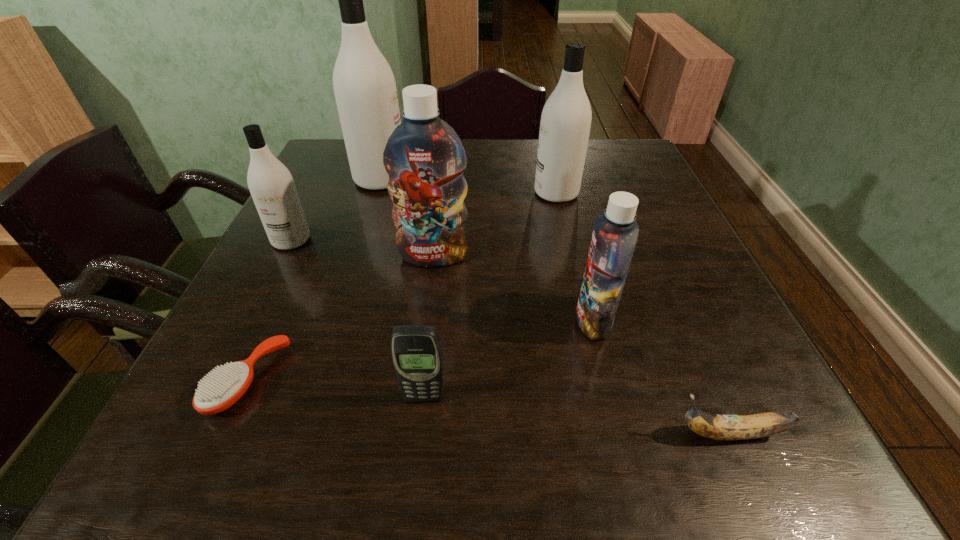
Locate an element on the screen. The width and height of the screenshot is (960, 540). vacant region located 0.190m on the front label of the fifth farthest object is located at coordinates (475, 320).

Locate an element on the screen. vacant point located 0.280m on the front label of the fifth farthest object is located at coordinates (427, 320).

Find the location of a particular element. vacant area located on the front label of the fifth farthest object is located at coordinates (544, 320).

The width and height of the screenshot is (960, 540). I want to click on vacant space located on the front-facing side of the smallest white shampoo, so click(224, 374).

Locate an element on the screen. blank space located on the screen of the cellular telephone is located at coordinates (415, 478).

I want to click on vacant space located on the peel of the rightmost object, so click(x=495, y=434).

At what (x,y) coordinates should I click in order to perform the action: click on vacant space located on the peel of the rightmost object. Please return your answer as a coordinate pair (x, y). Looking at the image, I should click on (475, 434).

Where is `free space located 0.320m on the peel of the rightmost object`? The width and height of the screenshot is (960, 540). free space located 0.320m on the peel of the rightmost object is located at coordinates (462, 434).

Where is `free space located on the right of the hairbrush`? free space located on the right of the hairbrush is located at coordinates [449, 381].

Where is `object located in the far edge section of the desktop`? object located in the far edge section of the desktop is located at coordinates (365, 89).